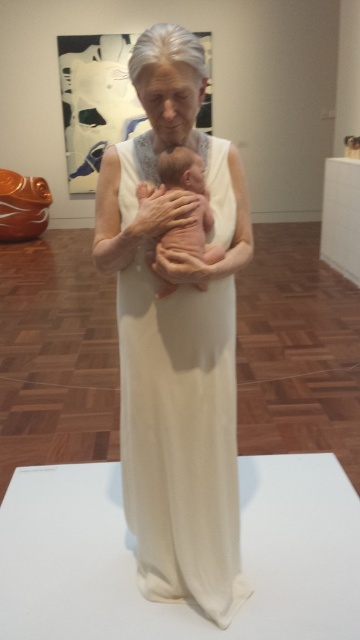
Question: In this image, where is white matte dress at center located relative to pink matte baby at center?

Choices:
 (A) right
 (B) left

Answer: (A)

Question: Which object appears farthest from the camera in this image?

Choices:
 (A) pink matte baby at center
 (B) white matte dress at center

Answer: (B)

Question: Can you confirm if white matte dress at center is bigger than pink matte baby at center?

Choices:
 (A) yes
 (B) no

Answer: (A)

Question: Does white matte dress at center have a greater width compared to pink matte baby at center?

Choices:
 (A) no
 (B) yes

Answer: (B)